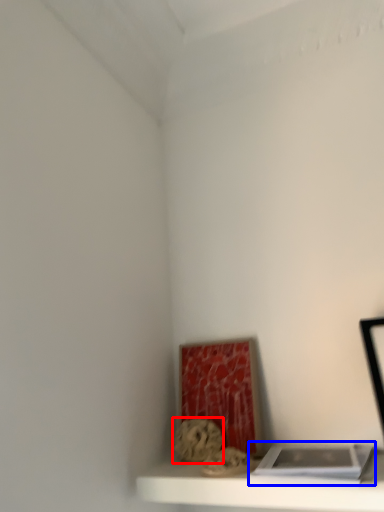
Question: Which object appears closest to the camera in this image, art (highlighted by a red box) or book (highlighted by a blue box)?

Choices:
 (A) art
 (B) book

Answer: (B)